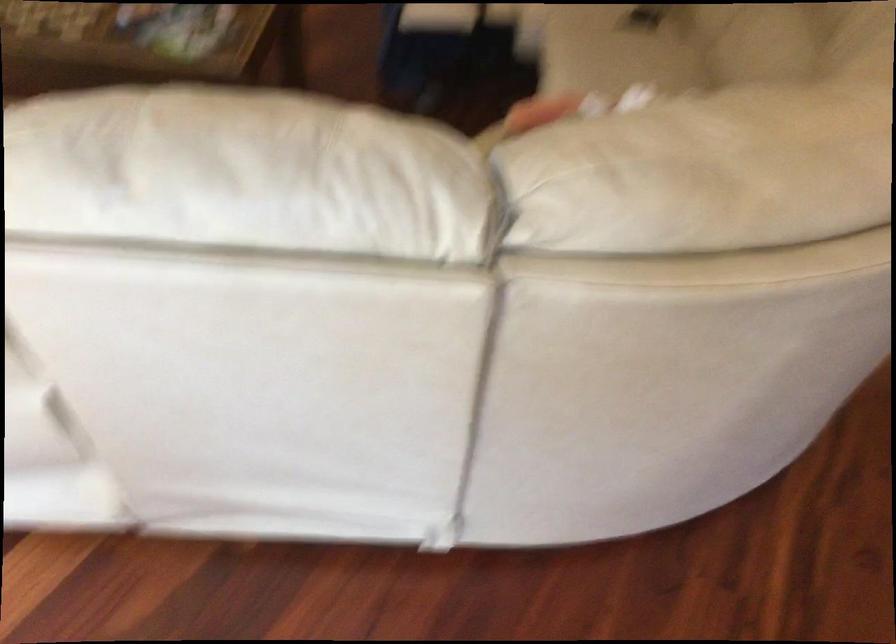
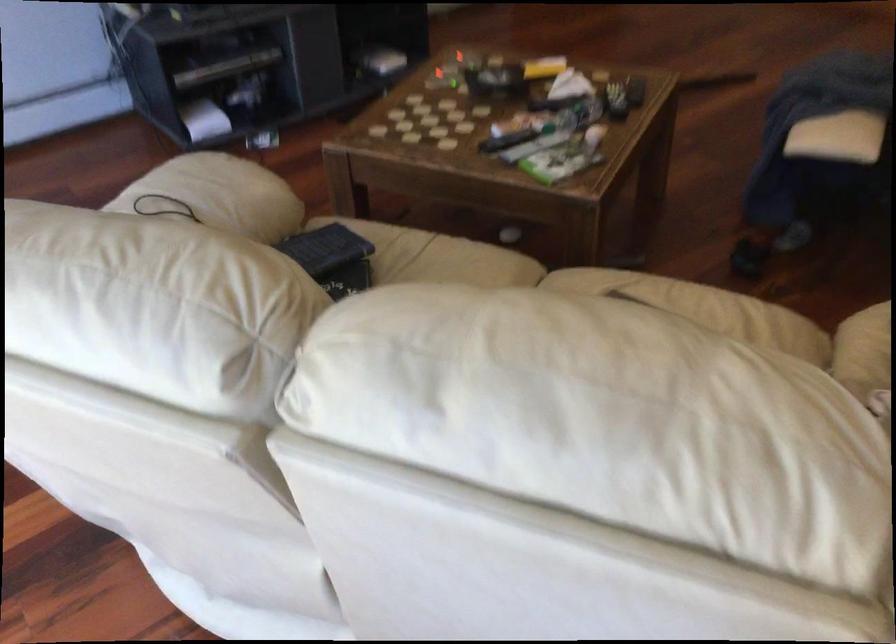
Question: I am providing you with two images of the same scene from different viewpoints. After the viewpoint changes to image2, which objects are now occluded?

Choices:
 (A) black remote control
 (B) white sofa sitting surface
 (C) shower faucet lever
 (D) green game case

Answer: (B)